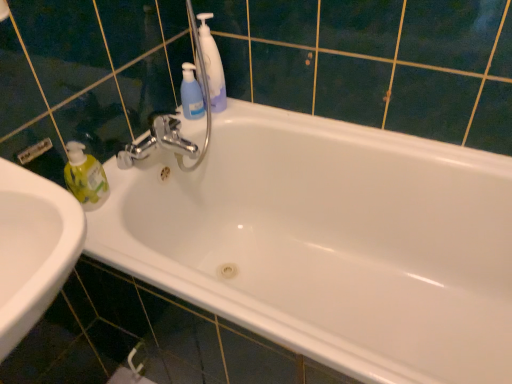
Question: Should I look upward or downward to see blue translucent bottle at upper center?

Choices:
 (A) up
 (B) down

Answer: (A)

Question: Does translucent blue pump bottle at upper center have a greater height compared to white glossy bathtub at center?

Choices:
 (A) yes
 (B) no

Answer: (B)

Question: Can you confirm if translucent blue pump bottle at upper center is shorter than white glossy bathtub at center?

Choices:
 (A) yes
 (B) no

Answer: (A)

Question: Considering the relative positions of translucent blue pump bottle at upper center and white glossy bathtub at center in the image provided, is translucent blue pump bottle at upper center to the right of white glossy bathtub at center from the viewer's perspective?

Choices:
 (A) yes
 (B) no

Answer: (B)

Question: From the image's perspective, is translucent blue pump bottle at upper center below white glossy bathtub at center?

Choices:
 (A) no
 (B) yes

Answer: (A)

Question: Considering the relative sizes of translucent blue pump bottle at upper center and white glossy bathtub at center in the image provided, is translucent blue pump bottle at upper center bigger than white glossy bathtub at center?

Choices:
 (A) no
 (B) yes

Answer: (A)

Question: Is translucent blue pump bottle at upper center facing away from white glossy bathtub at center?

Choices:
 (A) yes
 (B) no

Answer: (B)

Question: Is white glossy bathtub at center positioned before translucent blue pump bottle at upper center?

Choices:
 (A) no
 (B) yes

Answer: (B)

Question: Could you tell me if white glossy bathtub at center is turned towards translucent blue pump bottle at upper center?

Choices:
 (A) no
 (B) yes

Answer: (A)

Question: From the image's perspective, is white glossy bathtub at center below translucent blue pump bottle at upper center?

Choices:
 (A) yes
 (B) no

Answer: (A)

Question: Is white glossy bathtub at center taller than translucent blue pump bottle at upper center?

Choices:
 (A) yes
 (B) no

Answer: (A)

Question: Is white glossy bathtub at center wider than translucent blue pump bottle at upper center?

Choices:
 (A) yes
 (B) no

Answer: (A)

Question: From a real-world perspective, is white glossy bathtub at center on translucent blue pump bottle at upper center?

Choices:
 (A) yes
 (B) no

Answer: (B)

Question: Can you confirm if white glossy bathtub at center is taller than blue translucent bottle at upper center?

Choices:
 (A) no
 (B) yes

Answer: (B)